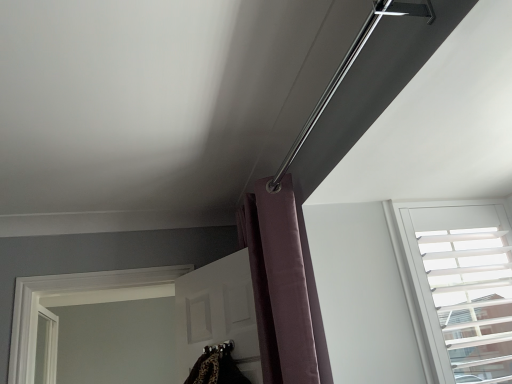
Question: Looking at their shapes, would you say purple velvet curtain at upper center is wider or thinner than white textured blinds at upper right?

Choices:
 (A) wide
 (B) thin

Answer: (A)

Question: From a real-world perspective, relative to white textured blinds at upper right, is purple velvet curtain at upper center vertically above or below?

Choices:
 (A) above
 (B) below

Answer: (A)

Question: From the image's perspective, is purple velvet curtain at upper center located above or below white textured blinds at upper right?

Choices:
 (A) below
 (B) above

Answer: (B)

Question: Is white textured blinds at upper right inside or outside of purple velvet curtain at upper center?

Choices:
 (A) outside
 (B) inside

Answer: (A)

Question: From a real-world perspective, is white textured blinds at upper right above or below purple velvet curtain at upper center?

Choices:
 (A) below
 (B) above

Answer: (A)

Question: Is white textured blinds at upper right in front of or behind purple velvet curtain at upper center in the image?

Choices:
 (A) behind
 (B) front

Answer: (A)

Question: Considering the positions of white textured blinds at upper right and purple velvet curtain at upper center in the image, is white textured blinds at upper right wider or thinner than purple velvet curtain at upper center?

Choices:
 (A) wide
 (B) thin

Answer: (B)